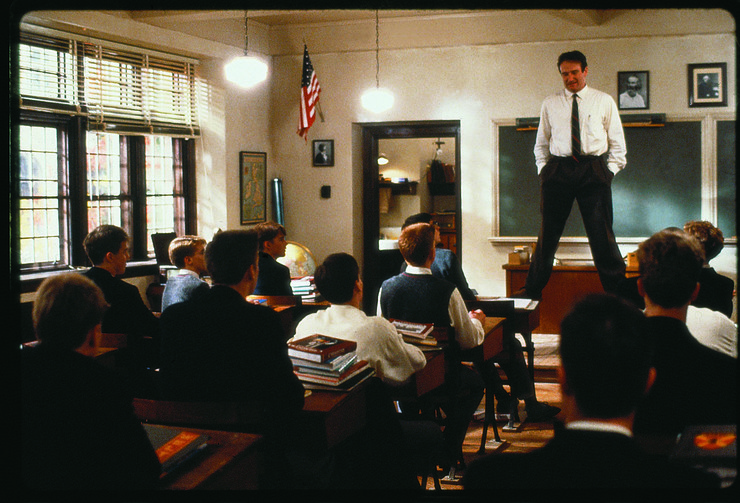
Where is `top left corner of teachers desk`? The height and width of the screenshot is (503, 740). top left corner of teachers desk is located at coordinates (510, 261).